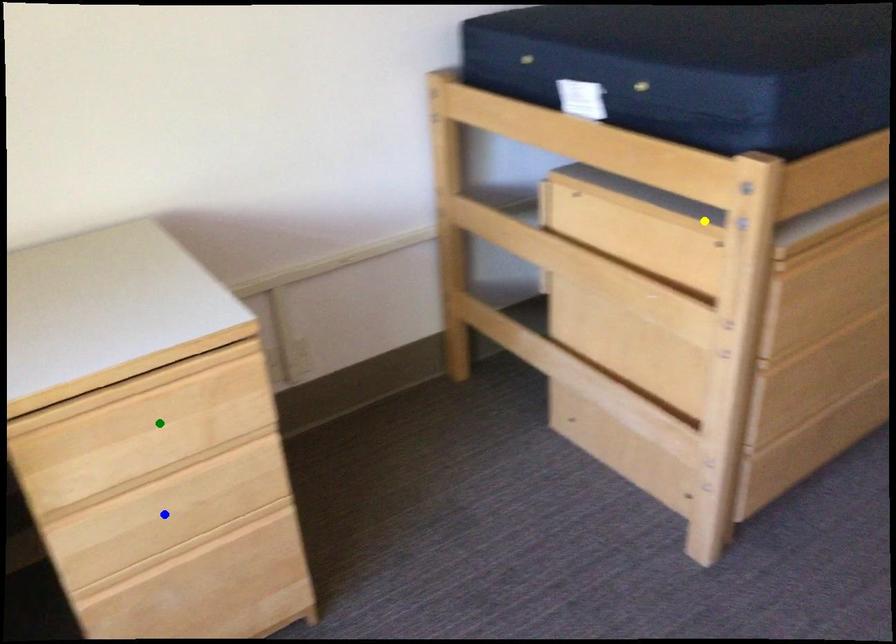
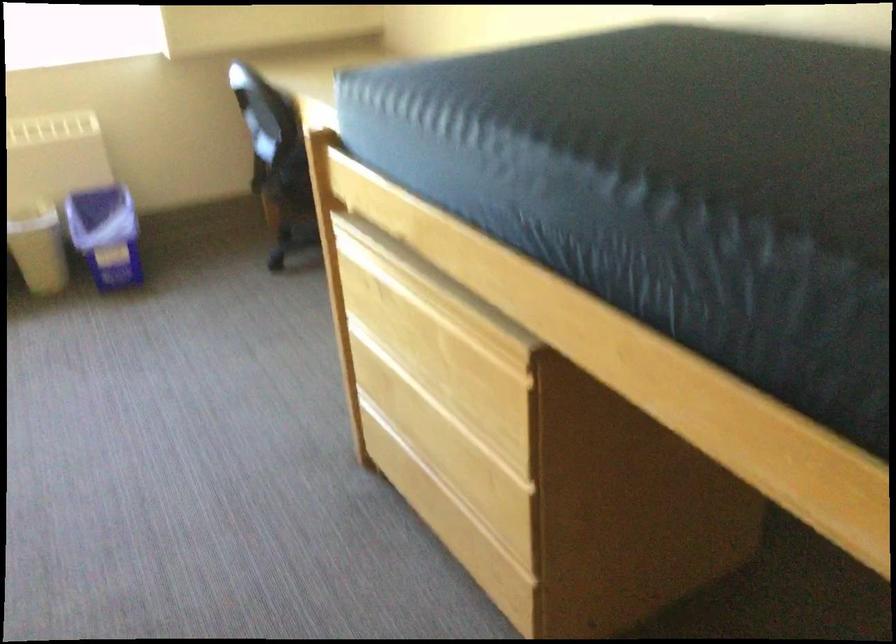
I am providing you with two images of the same scene from different viewpoints. Three points are marked in image1. Which point corresponds to a part or object that is occluded in image2?In image1, three points are marked. Which of them correspond to a part or object that is occluded in image2?Among the three points shown in image1, which one corresponds to a part or object that is no longer visible due to occlusion in image2?

blue point, yellow point, green point cannot be seen in image2.